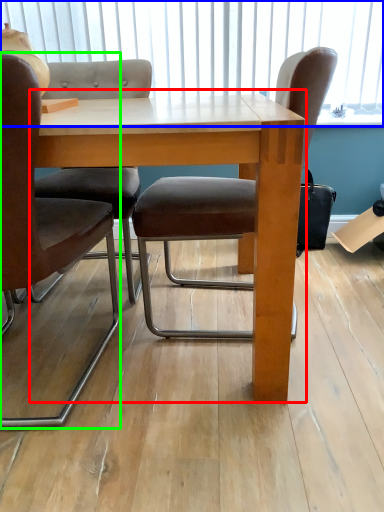
Question: Which object is positioned farthest from table (highlighted by a red box)? Select from window screen (highlighted by a blue box) and chair (highlighted by a green box).

Choices:
 (A) window screen
 (B) chair

Answer: (A)